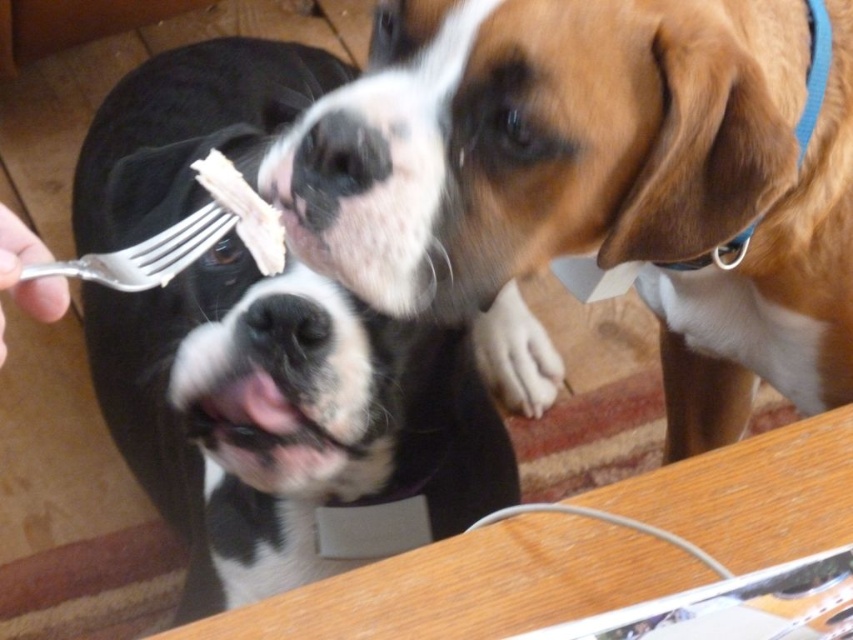
Can you confirm if white fur at lower center is taller than silver metallic fork at lower left?

Correct, white fur at lower center is much taller as silver metallic fork at lower left.

Is point (502, 376) farther from camera compared to point (206, 216)?

Yes, point (502, 376) is farther from viewer.

Where is `white fur at lower center`? white fur at lower center is located at coordinates (515, 355).

Can you confirm if brown furry dog at upper right is positioned above silver metallic fork at lower left?

No, brown furry dog at upper right is not above silver metallic fork at lower left.

Is point (436, 266) behind point (218, 234)?

No, (436, 266) is closer to viewer.

You are a GUI agent. You are given a task and a screenshot of the screen. Output one action in this format:
    pyautogui.click(x=<x>, y=<y>)
    Task: Click on the brown furry dog at upper right
    Image resolution: width=853 pixels, height=640 pixels.
    Given the screenshot: What is the action you would take?
    pyautogui.click(x=599, y=180)

Find the location of a particular element. brown furry dog at upper right is located at coordinates (599, 180).

The height and width of the screenshot is (640, 853). Describe the element at coordinates (599, 180) in the screenshot. I see `brown furry dog at upper right` at that location.

Who is higher up, brown furry dog at upper right or black glossy fur at left?

Positioned higher is brown furry dog at upper right.

Where is `brown furry dog at upper right`? brown furry dog at upper right is located at coordinates (599, 180).